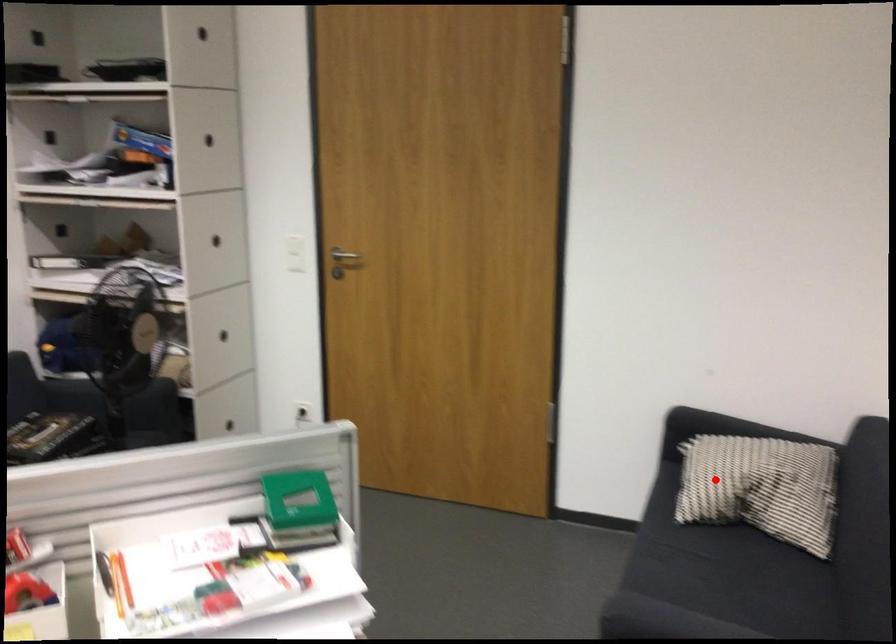
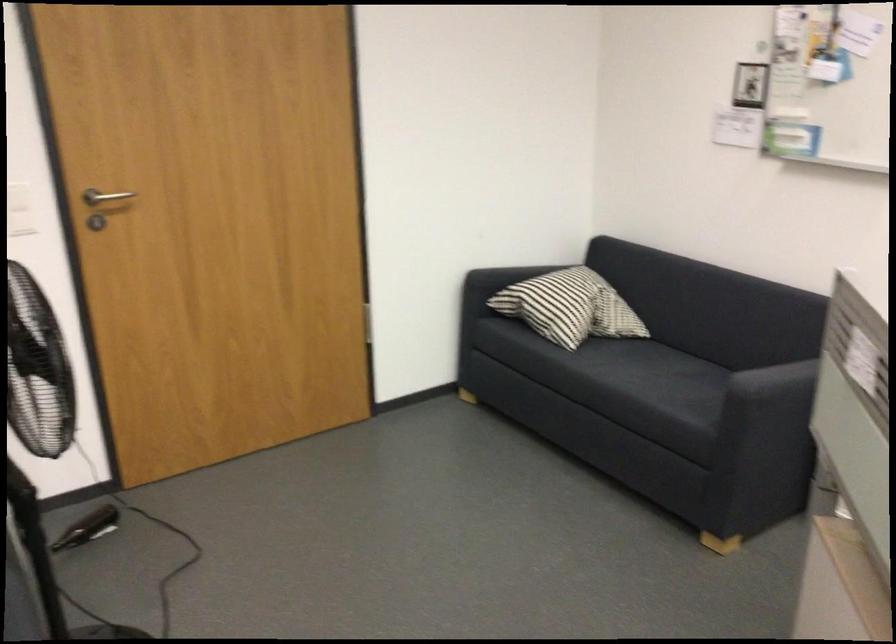
In the second image, find the point that corresponds to the highlighted location in the first image.

(570, 307)